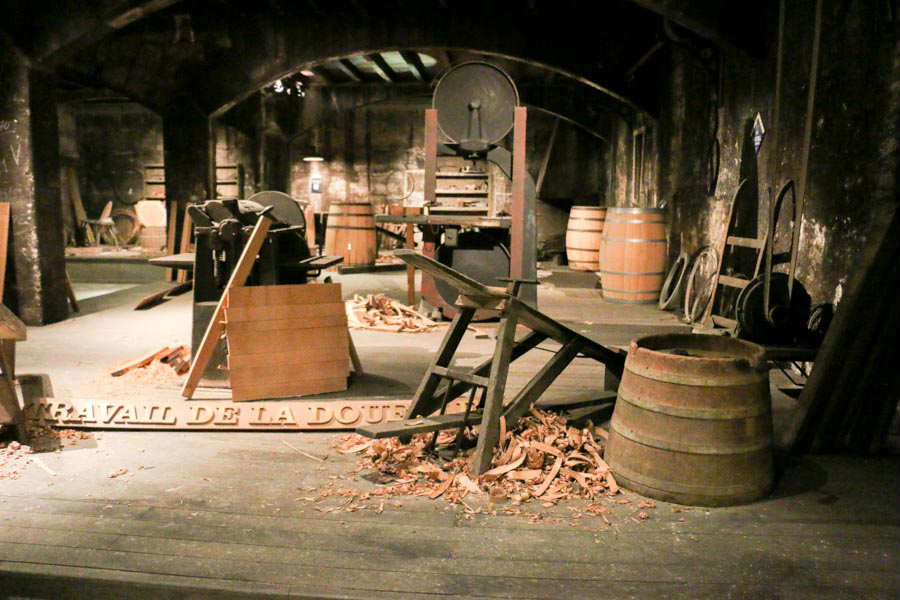
Locate an element on the screen. pillars is located at coordinates (47, 194), (189, 145).